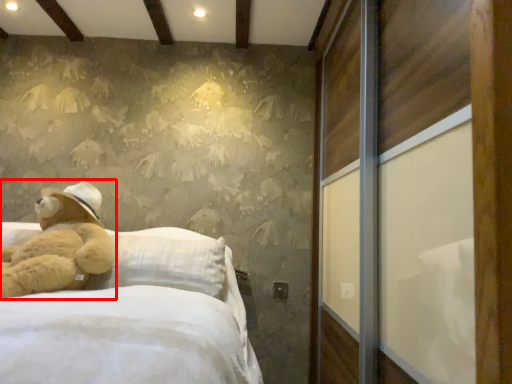
Question: In this image, where is teddy bear (annotated by the red box) located relative to screen door?

Choices:
 (A) right
 (B) left

Answer: (B)